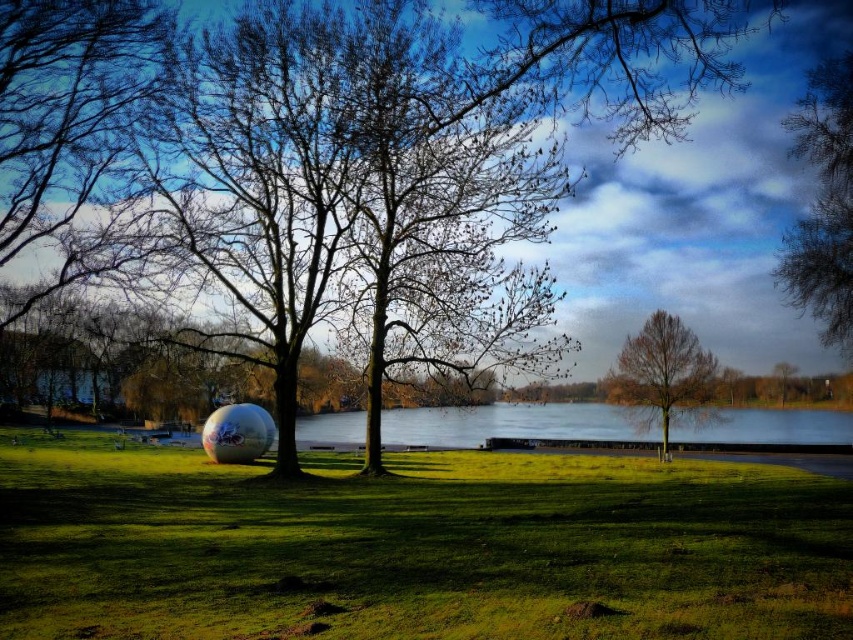
Question: Among these points, which one is farthest from the camera?

Choices:
 (A) (648, 394)
 (B) (227, 451)

Answer: (A)

Question: Is green grassy at center wider than green matte tree at center?

Choices:
 (A) no
 (B) yes

Answer: (B)

Question: Is bare branches at upper right further to camera compared to glossy metallic beach ball at lower left?

Choices:
 (A) yes
 (B) no

Answer: (B)

Question: Can you confirm if clear water at center is wider than bare branches at upper right?

Choices:
 (A) no
 (B) yes

Answer: (B)

Question: Which point is closer to the camera taking this photo?

Choices:
 (A) (840, 134)
 (B) (657, 374)
 (C) (436, 440)

Answer: (A)

Question: Among these objects, which one is farthest from the camera?

Choices:
 (A) glossy metallic beach ball at lower left
 (B) bare branches at upper right

Answer: (A)